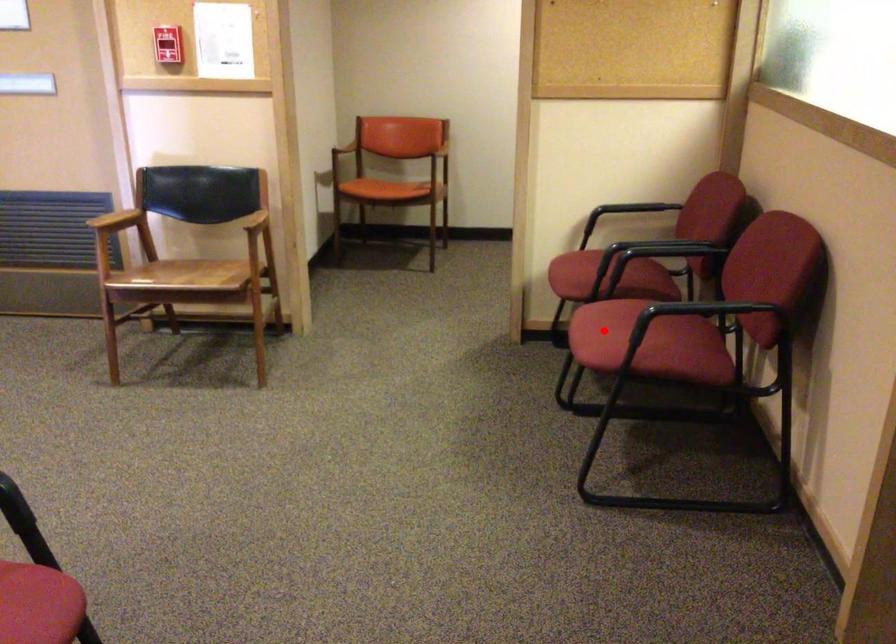
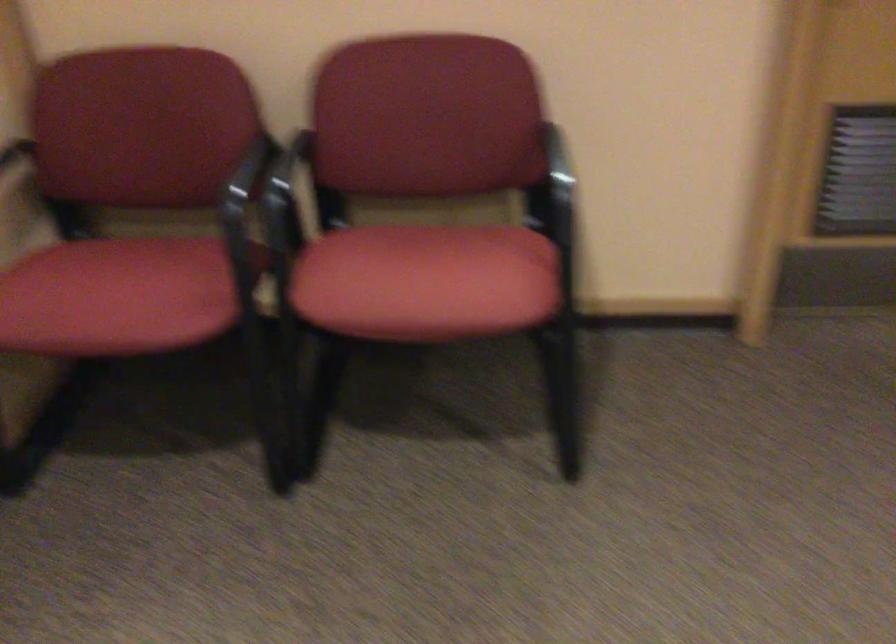
Question: I am providing you with two images of the same scene from different viewpoints. In image1, a red point is highlighted. Considering the same 3D point in image2, which of the following is correct?

Choices:
 (A) It is closer
 (B) It is farther

Answer: (A)